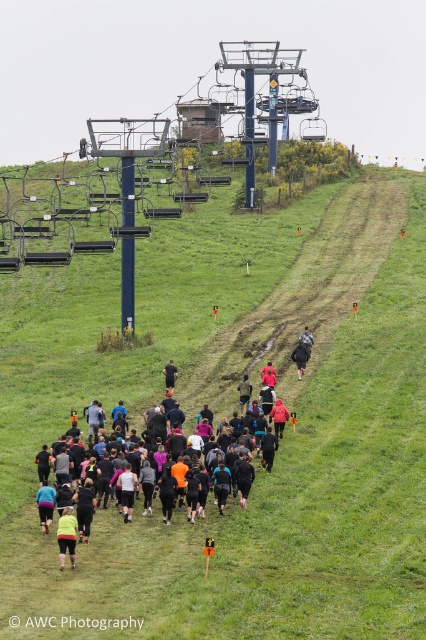
From the picture: You are a photographer positioned at the point with coordinates (126, 490) in the image. What is the object located at your current position?

The point at coordinates (126, 490) indicates a black fabric running suit at center.

You are a photographer positioned at the top of the hill. You want to capture a photo of both the black fabric running suit at center and the black matte jacket at center in the same frame. Based on their positions, which one should you focus on first to ensure both are in the shot?

The black fabric running suit at center is located below the black matte jacket at center, so you should focus on the black matte jacket at center first to ensure both are in the shot.